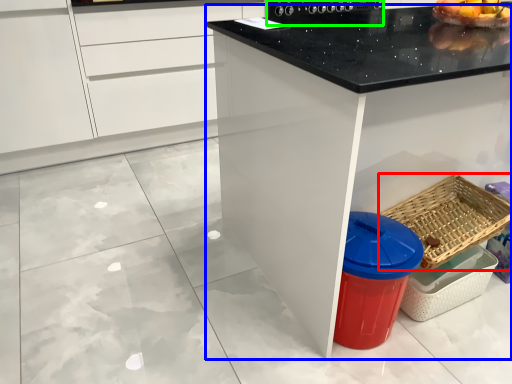
Question: Considering the real-world distances, which object is closest to basket (highlighted by a red box)? countertop (highlighted by a blue box) or appliance (highlighted by a green box).

Choices:
 (A) countertop
 (B) appliance

Answer: (A)